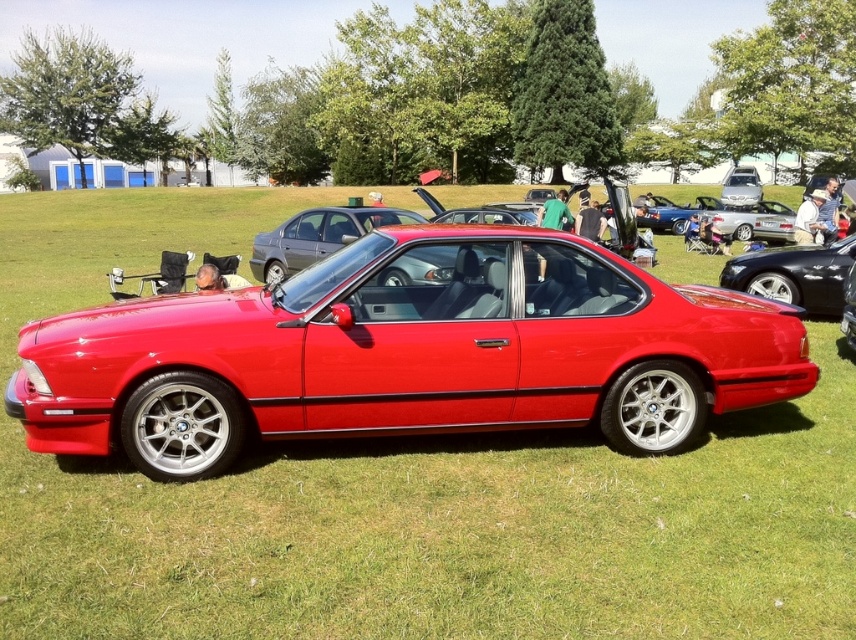
Between glossy metallic car at center and glossy metallic sedan at center, which one appears on the left side from the viewer's perspective?

glossy metallic sedan at center

Can you confirm if glossy metallic car at center is positioned to the left of glossy metallic sedan at center?

In fact, glossy metallic car at center is to the right of glossy metallic sedan at center.

Does point (788, 269) lie in front of point (327, 230)?

Yes, point (788, 269) is in front of point (327, 230).

At what (x,y) coordinates should I click in order to perform the action: click on glossy metallic car at center. Please return your answer as a coordinate pair (x, y). This screenshot has height=640, width=856. Looking at the image, I should click on (794, 275).

Who is shorter, glossy red car at center or glossy metallic sedan at center?

glossy metallic sedan at center is shorter.

How distant is glossy red car at center from glossy metallic sedan at center?

They are 5.92 meters apart.

Looking at this image, measure the distance between point [54,444] and camera.

They are 4.24 meters apart.

At what (x,y) coordinates should I click in order to perform the action: click on glossy red car at center. Please return your answer as a coordinate pair (x, y). Image resolution: width=856 pixels, height=640 pixels. Looking at the image, I should click on (406, 353).

Is glossy red car at center bigger than glossy metallic car at center?

Correct, glossy red car at center is larger in size than glossy metallic car at center.

From the picture: Between glossy red car at center and glossy metallic car at center, which one appears on the left side from the viewer's perspective?

glossy red car at center is more to the left.

The image size is (856, 640). Describe the element at coordinates (406, 353) in the screenshot. I see `glossy red car at center` at that location.

Image resolution: width=856 pixels, height=640 pixels. Find the location of `glossy red car at center`. glossy red car at center is located at coordinates (406, 353).